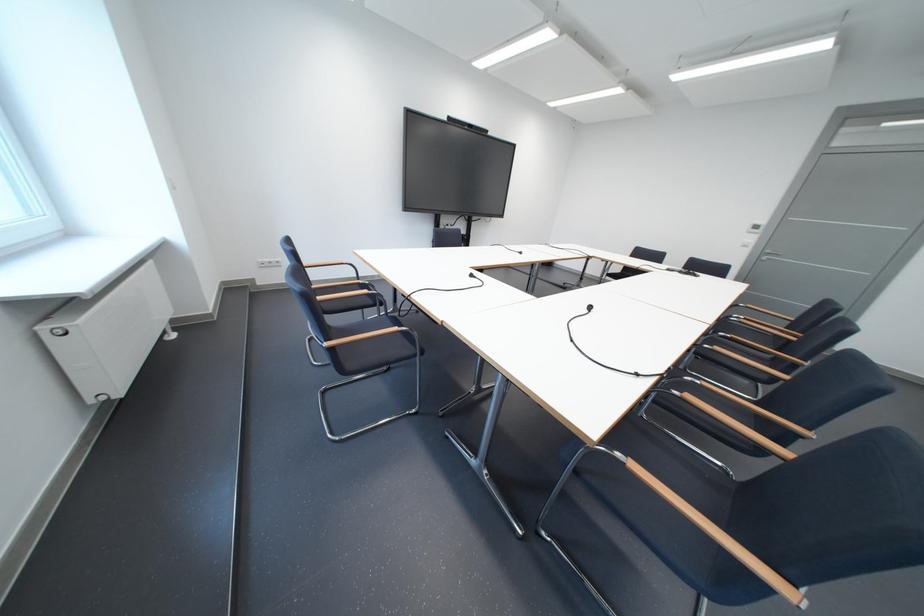
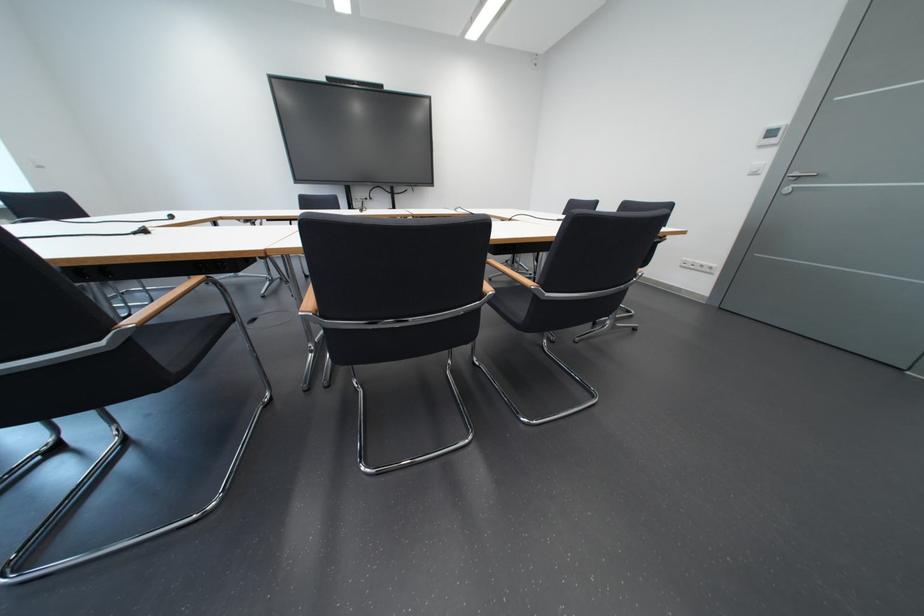
In a continuous first-person perspective shot, in which direction is the camera moving?

The cameraman walked toward right, forward.